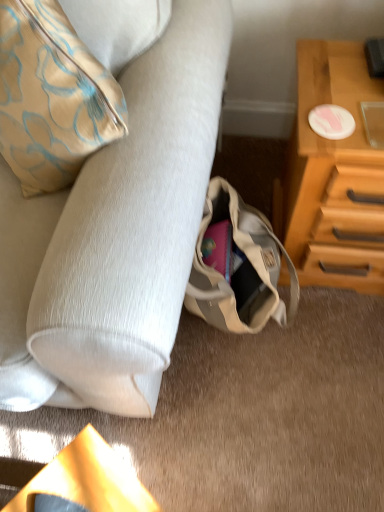
Question: Is suede-like beige couch at lower left situated inside wooden chest of drawers at right or outside?

Choices:
 (A) inside
 (B) outside

Answer: (B)

Question: Is suede-like beige couch at lower left bigger or smaller than wooden chest of drawers at right?

Choices:
 (A) small
 (B) big

Answer: (B)

Question: Which object is the closest to the wooden chest of drawers at right?

Choices:
 (A) beige canvas bag at lower center
 (B) suede-like beige couch at lower left

Answer: (A)

Question: Based on their relative distances, which object is farther from the suede-like beige couch at lower left?

Choices:
 (A) beige canvas bag at lower center
 (B) wooden chest of drawers at right

Answer: (B)